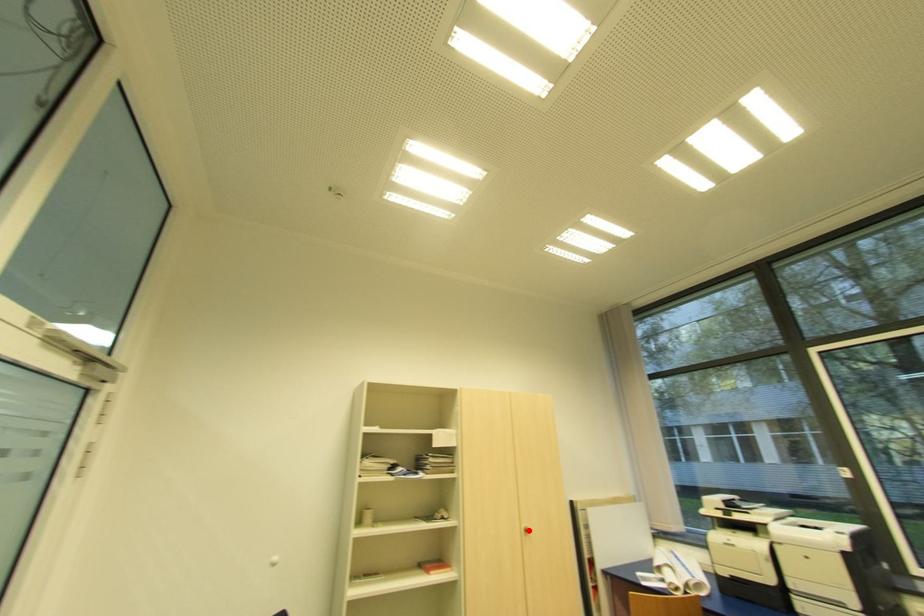
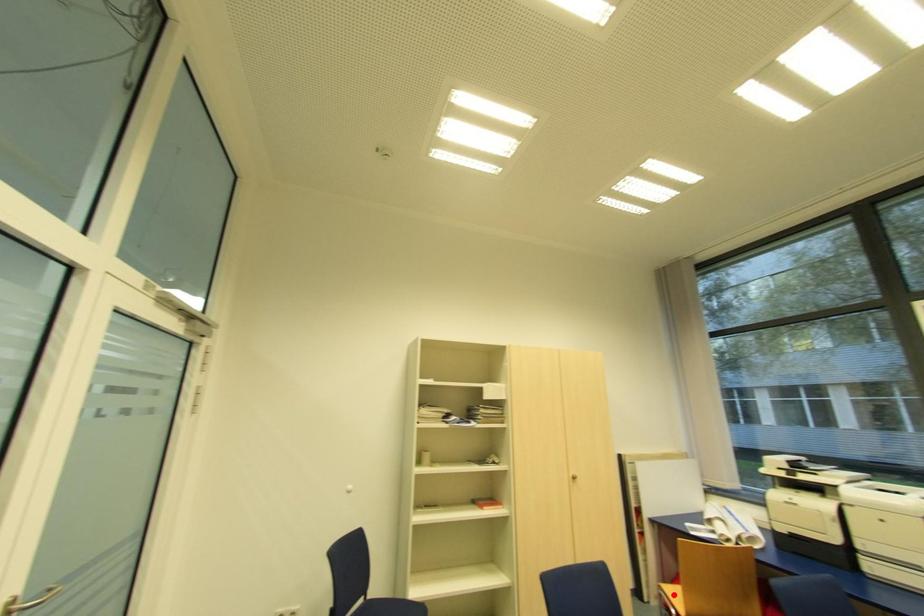
I am providing you with two images of the same scene from different viewpoints. A red point is marked on the first image and another point is marked on the second image. Do the highlighted points in image1 and image2 indicate the same real-world spot?

No